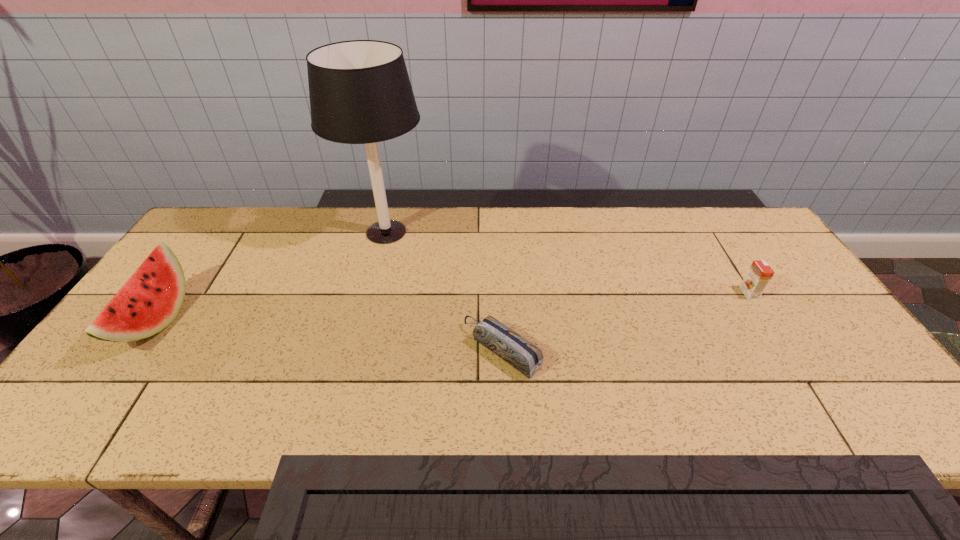
Locate an element on the screen. free region located on the front of the rightmost object is located at coordinates (791, 360).

You are a GUI agent. You are given a task and a screenshot of the screen. Output one action in this format:
    pyautogui.click(x=<x>, y=<y>)
    Task: Click on the free space located 0.250m on the back of the shortest object
    
    Given the screenshot: What is the action you would take?
    pyautogui.click(x=498, y=261)

At what (x,y) coordinates should I click in order to perform the action: click on object that is at the far edge. Please return your answer as a coordinate pair (x, y). The width and height of the screenshot is (960, 540). Looking at the image, I should click on (360, 93).

This screenshot has width=960, height=540. Find the location of `object that is at the left edge`. object that is at the left edge is located at coordinates coord(152,297).

The image size is (960, 540). Find the location of `object situated at the right edge`. object situated at the right edge is located at coordinates (759, 274).

This screenshot has width=960, height=540. In the image, there is a desktop. Find the location of `vacant space at the far edge`. vacant space at the far edge is located at coordinates (649, 211).

Locate an element on the screen. free space at the near edge is located at coordinates (522, 414).

Identify the location of vacant space at the left edge. (143, 370).

The width and height of the screenshot is (960, 540). In the image, there is a desktop. In order to click on free space at the right edge in this screenshot , I will do point(783,275).

Locate an element on the screen. The height and width of the screenshot is (540, 960). vacant space at the far left corner of the desktop is located at coordinates (192, 247).